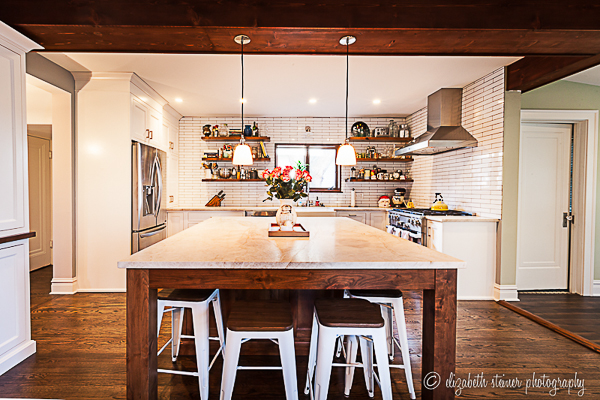
You are a GUI agent. You are given a task and a screenshot of the screen. Output one action in this format:
    pyautogui.click(x=<x>, y=<y>)
    Task: Click on the stools
    This screenshot has height=400, width=600.
    Given the screenshot: What is the action you would take?
    pyautogui.click(x=188, y=298), pyautogui.click(x=264, y=321), pyautogui.click(x=354, y=319), pyautogui.click(x=387, y=295)